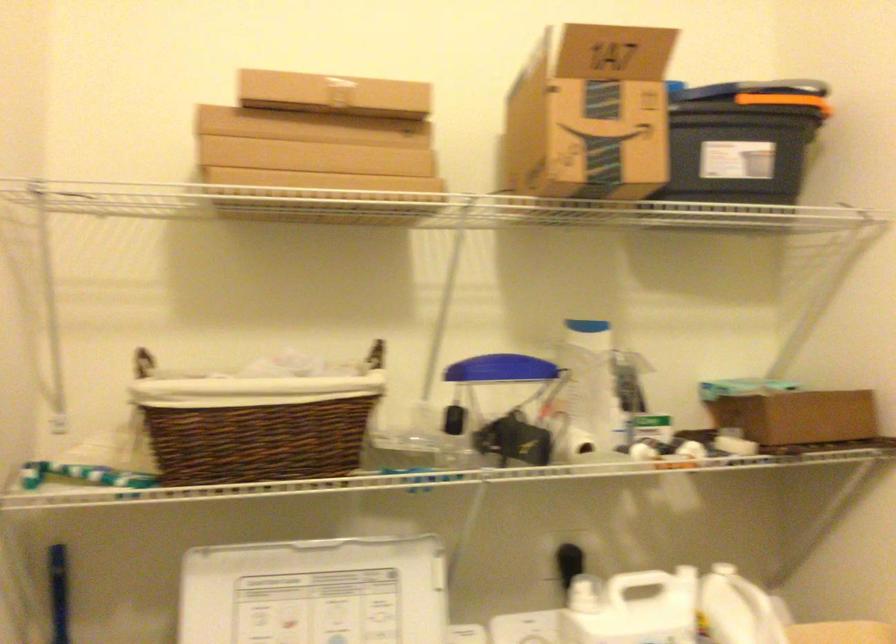
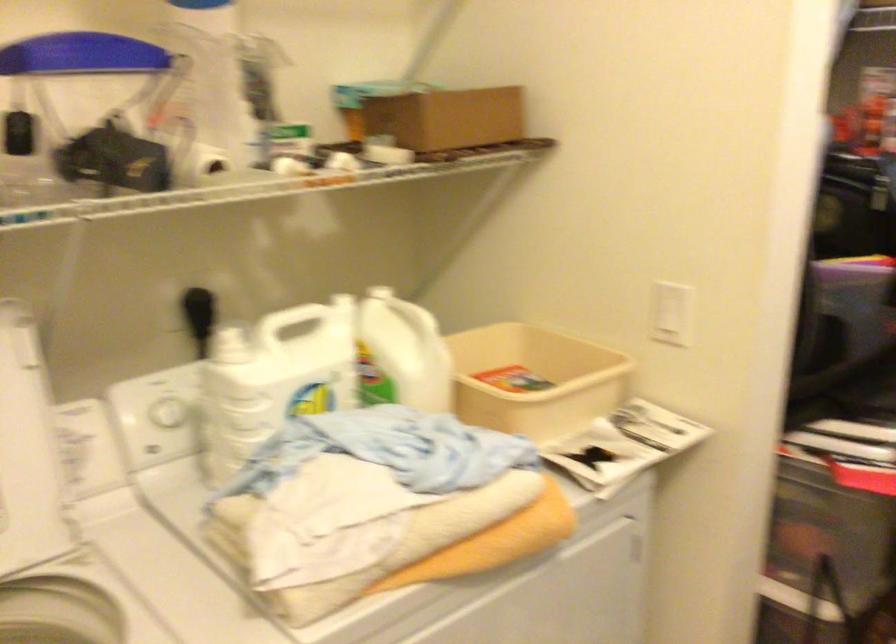
Locate, in the second image, the point that corresponds to [567,564] in the first image.

(197, 303)